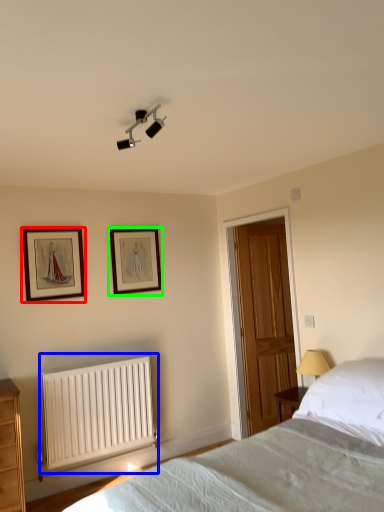
Question: Which object is the closest to the picture frame (highlighted by a red box)? Choose among these: radiator (highlighted by a blue box) or picture frame (highlighted by a green box).

Choices:
 (A) radiator
 (B) picture frame

Answer: (B)